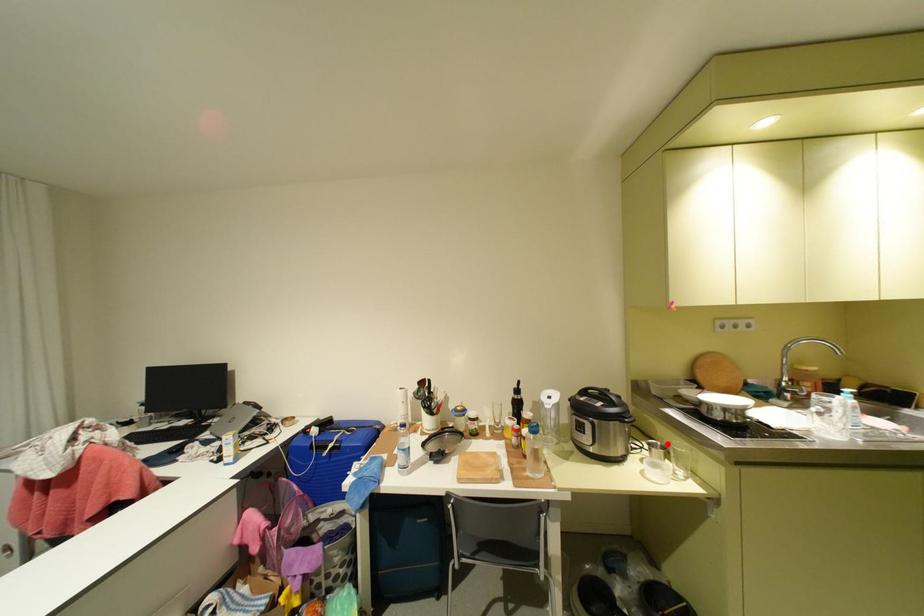
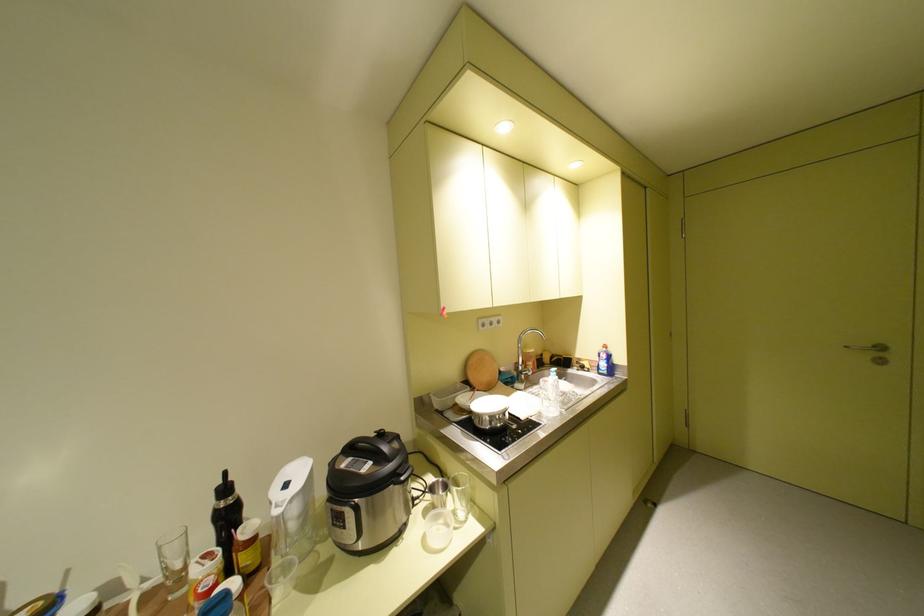
Question: I am providing you with two images of the same scene from different viewpoints. In image1, a red point is highlighted. Considering the same 3D point in image2, which of the following is correct?

Choices:
 (A) It is closer
 (B) It is farther

Answer: (B)